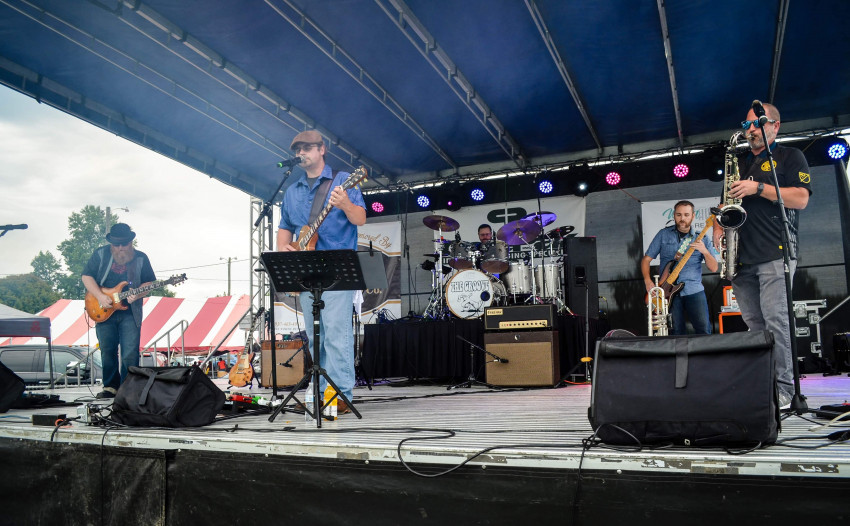
Image resolution: width=850 pixels, height=526 pixels. I want to click on music stand, so click(x=312, y=269).